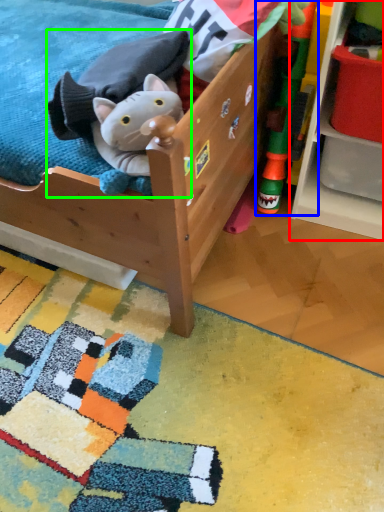
Question: Which is nearer to the shelf (highlighted by a red box)? toy (highlighted by a blue box) or toy (highlighted by a green box).

Choices:
 (A) toy
 (B) toy

Answer: (A)